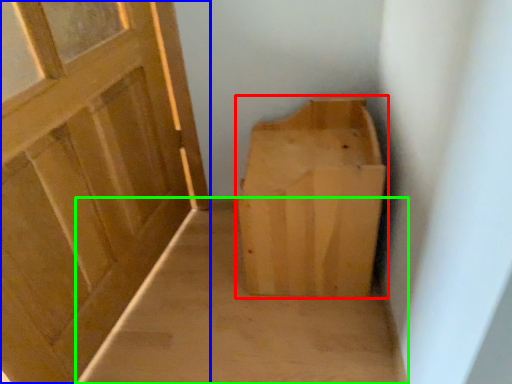
Question: Based on their relative distances, which object is nearer to furniture (highlighted by a red box)? Choose from door (highlighted by a blue box) and plain (highlighted by a green box).

Choices:
 (A) door
 (B) plain

Answer: (B)